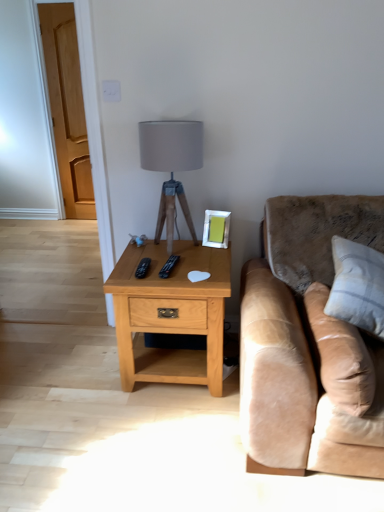
Locate an element on the screen. The height and width of the screenshot is (512, 384). light oak wood nightstand at center is located at coordinates (170, 314).

The width and height of the screenshot is (384, 512). I want to click on silver metallic picture frame at upper right, so click(x=216, y=229).

What do you see at coordinates (309, 345) in the screenshot?
I see `suede beige couch at right` at bounding box center [309, 345].

Where is `white cotton pillow at right, which is counted as the 1th pillow, starting from the right`? The width and height of the screenshot is (384, 512). white cotton pillow at right, which is counted as the 1th pillow, starting from the right is located at coordinates (357, 286).

From the picture: Is black plastic remote at center located within silver metallic picture frame at upper right?

No, black plastic remote at center is not a part of silver metallic picture frame at upper right.

From a real-world perspective, who is located higher, silver metallic picture frame at upper right or black plastic remote at center?

From a 3D spatial view, silver metallic picture frame at upper right is above.

Is the surface of silver metallic picture frame at upper right in direct contact with black plastic remote at center?

No, silver metallic picture frame at upper right is not beside black plastic remote at center.

Where is `remote below the silver metallic picture frame at upper right (from a real-world perspective)`? This screenshot has height=512, width=384. remote below the silver metallic picture frame at upper right (from a real-world perspective) is located at coordinates (169, 266).

From the image's perspective, which one is positioned lower, matte gray fabric lampshade at center or silver metallic picture frame at upper right?

silver metallic picture frame at upper right appears lower in the image.

Looking at their sizes, would you say matte gray fabric lampshade at center is wider or thinner than silver metallic picture frame at upper right?

In the image, matte gray fabric lampshade at center appears to be wider than silver metallic picture frame at upper right.

Does point (165, 138) come behind point (214, 212)?

No, it is not.

From a real-world perspective, relative to light oak wood nightstand at center, is black plastic remote at center vertically above or below?

From a real-world perspective, black plastic remote at center is physically above light oak wood nightstand at center.

Looking at this image, can you confirm if black plastic remote at center is positioned to the left of light oak wood nightstand at center?

Correct, you'll find black plastic remote at center to the left of light oak wood nightstand at center.

Is point (171, 266) closer to viewer compared to point (115, 286)?

That is False.

From the image's perspective, which object appears higher, black plastic remote at center or light oak wood nightstand at center?

black plastic remote at center, from the image's perspective.

Is white cotton pillow at right, which is counted as the 1th pillow, starting from the right, thinner than beige leather pillow at right, arranged as the 2th pillow when viewed from the right?

In fact, white cotton pillow at right, which is counted as the 1th pillow, starting from the right, might be wider than beige leather pillow at right, arranged as the 2th pillow when viewed from the right.

Which object is further away from the camera taking this photo, white cotton pillow at right, which is the second pillow in left-to-right order, or beige leather pillow at right, which is the first pillow in left-to-right order?

Positioned behind is white cotton pillow at right, which is the second pillow in left-to-right order.

Which is more to the right, white cotton pillow at right, which is the second pillow in left-to-right order, or beige leather pillow at right, which is the first pillow in left-to-right order?

From the viewer's perspective, white cotton pillow at right, which is the second pillow in left-to-right order, appears more on the right side.

Is matte gray fabric lampshade at center oriented towards light oak wood nightstand at center?

No, matte gray fabric lampshade at center does not turn towards light oak wood nightstand at center.

Can we say matte gray fabric lampshade at center lies outside light oak wood nightstand at center?

Absolutely, matte gray fabric lampshade at center is external to light oak wood nightstand at center.

Considering the points (207, 238) and (158, 139), which point is behind, point (207, 238) or point (158, 139)?

The point (207, 238) is behind.

Considering the relative sizes of silver metallic picture frame at upper right and matte gray fabric lampshade at center in the image provided, is silver metallic picture frame at upper right thinner than matte gray fabric lampshade at center?

Yes, silver metallic picture frame at upper right is thinner than matte gray fabric lampshade at center.

Is silver metallic picture frame at upper right turned away from matte gray fabric lampshade at center?

No, matte gray fabric lampshade at center is not at the back of silver metallic picture frame at upper right.

From the image's perspective, between black plastic remote at center and silver metallic picture frame at upper right, which one is located above?

From the image's view, silver metallic picture frame at upper right is above.

Between point (172, 265) and point (224, 241), which one is positioned in front?

The point (172, 265) is closer.

Does black plastic remote at center come behind silver metallic picture frame at upper right?

No, black plastic remote at center is closer to the viewer.

How far apart are black plastic remote at center and silver metallic picture frame at upper right?

10.75 inches.

Where is `remote that appears on the left of silver metallic picture frame at upper right`? remote that appears on the left of silver metallic picture frame at upper right is located at coordinates (169, 266).

Find the location of a particular element. table lamp located above the silver metallic picture frame at upper right (from the image's perspective) is located at coordinates (171, 160).

When comparing their distances from white cotton pillow at right, which is counted as the 1th pillow, starting from the right, does silver metallic picture frame at upper right or suede beige couch at right seem further?

Among the two, silver metallic picture frame at upper right is located further to white cotton pillow at right, which is counted as the 1th pillow, starting from the right.

When comparing their distances from matte gray fabric lampshade at center, does silver metallic picture frame at upper right or suede beige couch at right seem closer?

The object closer to matte gray fabric lampshade at center is silver metallic picture frame at upper right.

Estimate the real-world distances between objects in this image. Which object is further from suede beige couch at right, white cotton pillow at right, which is counted as the 1th pillow, starting from the right, or beige leather pillow at right, which is the first pillow in left-to-right order?

white cotton pillow at right, which is counted as the 1th pillow, starting from the right, is further to suede beige couch at right.

Which object lies nearer to the anchor point light oak wood nightstand at center, suede beige couch at right or matte gray fabric lampshade at center?

matte gray fabric lampshade at center lies closer to light oak wood nightstand at center than the other object.

Based on their spatial positions, is black plastic remote at center or light oak wood nightstand at center closer to suede beige couch at right?

light oak wood nightstand at center.

Looking at the image, which one is located closer to silver metallic picture frame at upper right, light oak wood nightstand at center or black plastic remote at center?

black plastic remote at center is positioned closer to the anchor silver metallic picture frame at upper right.

Looking at the image, which one is located closer to matte gray fabric lampshade at center, suede beige couch at right or beige leather pillow at right, arranged as the 2th pillow when viewed from the right?

Based on the image, suede beige couch at right appears to be nearer to matte gray fabric lampshade at center.

Looking at the image, which one is located further to black plastic remote at center, matte gray fabric lampshade at center or silver metallic picture frame at upper right?

Among the two, matte gray fabric lampshade at center is located further to black plastic remote at center.

Where is `nightstand situated between black plastic remote at center and suede beige couch at right from left to right`? The image size is (384, 512). nightstand situated between black plastic remote at center and suede beige couch at right from left to right is located at coordinates (170, 314).

The image size is (384, 512). I want to click on nightstand between black plastic remote at center and beige leather pillow at right, which is the first pillow in left-to-right order, from left to right, so click(x=170, y=314).

I want to click on table lamp between beige leather pillow at right, which is the first pillow in left-to-right order, and silver metallic picture frame at upper right, along the z-axis, so click(x=171, y=160).

Locate an element on the screen. The height and width of the screenshot is (512, 384). studio couch situated between light oak wood nightstand at center and white cotton pillow at right, which is the second pillow in left-to-right order, from left to right is located at coordinates (309, 345).